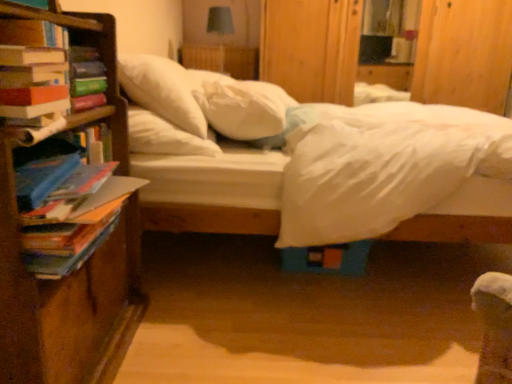
Where is `blue fabric lampshade at upper center`? The height and width of the screenshot is (384, 512). blue fabric lampshade at upper center is located at coordinates (220, 26).

The width and height of the screenshot is (512, 384). What do you see at coordinates (162, 91) in the screenshot?
I see `white soft pillow at center, arranged as the 1th pillow when viewed from the left` at bounding box center [162, 91].

You are a GUI agent. You are given a task and a screenshot of the screen. Output one action in this format:
    pyautogui.click(x=<x>, y=<y>)
    Task: Click on the white soft bed at center
    
    Given the screenshot: What is the action you would take?
    pyautogui.click(x=194, y=158)

Image resolution: width=512 pixels, height=384 pixels. I want to click on hardcover book at left, which is the first book from top to bottom, so click(x=32, y=35).

Describe the element at coordinates (68, 241) in the screenshot. I see `multicolored paper book at left, the second book viewed from the top` at that location.

What do you see at coordinates (240, 105) in the screenshot? I see `white soft pillow at center, which ranks as the 1th pillow in right-to-left order` at bounding box center [240, 105].

Identify the location of blue fabric lampshade at upper center. (220, 26).

Based on the photo, from the image's perspective, is white soft bed at center located above or below wooden bookcase at left?

white soft bed at center is above wooden bookcase at left.

Can you confirm if white soft bed at center is positioned to the right of wooden bookcase at left?

Yes, white soft bed at center is to the right of wooden bookcase at left.

Is white soft bed at center not close to wooden bookcase at left?

That's not correct — white soft bed at center is a little close to wooden bookcase at left.

Would you say white soft bed at center is inside or outside wooden bookcase at left?

white soft bed at center is outside wooden bookcase at left.

From the picture: Considering the sizes of objects white soft pillow at center, the 2th pillow when ordered from right to left, and blue fabric lampshade at upper center in the image provided, who is taller, white soft pillow at center, the 2th pillow when ordered from right to left, or blue fabric lampshade at upper center?

Standing taller between the two is blue fabric lampshade at upper center.

Is white soft pillow at center, the 2th pillow when ordered from right to left, oriented away from blue fabric lampshade at upper center?

No, white soft pillow at center, the 2th pillow when ordered from right to left, is not facing away from blue fabric lampshade at upper center.

Is white soft pillow at center, the 2th pillow when ordered from right to left, thinner than blue fabric lampshade at upper center?

Incorrect, the width of white soft pillow at center, the 2th pillow when ordered from right to left, is not less than that of blue fabric lampshade at upper center.

Identify the location of pillow that is the 1st object to the right of the hardcover book at left, positioned as the second book in bottom-to-top order, starting at the anchor. (162, 91).

Considering the positions of objects hardcover book at left, positioned as the second book in bottom-to-top order, and white soft pillow at center, the 2th pillow when ordered from right to left, in the image provided, who is behind, hardcover book at left, positioned as the second book in bottom-to-top order, or white soft pillow at center, the 2th pillow when ordered from right to left,?

white soft pillow at center, the 2th pillow when ordered from right to left, is further away from the camera.

Which is behind, point (59, 80) or point (132, 70)?

The point (132, 70) is farther from the camera.

Based on the photo, from a real-world perspective, who is located lower, wooden bookcase at left or white soft bed at center?

white soft bed at center, from a real-world perspective.

Based on the photo, is wooden bookcase at left placed right next to white soft bed at center?

wooden bookcase at left and white soft bed at center are clearly separated.

Considering the sizes of wooden bookcase at left and white soft bed at center in the image, is wooden bookcase at left wider or thinner than white soft bed at center?

Clearly, wooden bookcase at left has less width compared to white soft bed at center.

Is multicolored paper book at left, placed as the first book when sorted from bottom to top, located outside hardcover book at left, which is the first book from top to bottom?

Yes, multicolored paper book at left, placed as the first book when sorted from bottom to top, is located beyond the bounds of hardcover book at left, which is the first book from top to bottom.

Considering the relative sizes of multicolored paper book at left, the second book viewed from the top, and hardcover book at left, positioned as the second book in bottom-to-top order, in the image provided, is multicolored paper book at left, the second book viewed from the top, bigger than hardcover book at left, positioned as the second book in bottom-to-top order,?

Yes, multicolored paper book at left, the second book viewed from the top, is bigger than hardcover book at left, positioned as the second book in bottom-to-top order.

From the image's perspective, is multicolored paper book at left, the second book viewed from the top, located above hardcover book at left, which is the first book from top to bottom?

No, from the image's perspective, multicolored paper book at left, the second book viewed from the top, is not above hardcover book at left, which is the first book from top to bottom.

Between multicolored paper book at left, the second book viewed from the top, and hardcover book at left, positioned as the second book in bottom-to-top order, which one has larger width?

multicolored paper book at left, the second book viewed from the top.

Is multicolored paper book at left, placed as the first book when sorted from bottom to top, oriented away from white soft pillow at center, arranged as the 1th pillow when viewed from the left?

That's not correct — multicolored paper book at left, placed as the first book when sorted from bottom to top, is not looking away from white soft pillow at center, arranged as the 1th pillow when viewed from the left.

Is multicolored paper book at left, the second book viewed from the top, positioned far away from white soft pillow at center, arranged as the 1th pillow when viewed from the left?

multicolored paper book at left, the second book viewed from the top, is near white soft pillow at center, arranged as the 1th pillow when viewed from the left, not far away.

Considering their positions, is multicolored paper book at left, placed as the first book when sorted from bottom to top, located in front of or behind white soft pillow at center, arranged as the 1th pillow when viewed from the left?

Clearly, multicolored paper book at left, placed as the first book when sorted from bottom to top, is in front of white soft pillow at center, arranged as the 1th pillow when viewed from the left.

Starting from the white soft pillow at center, arranged as the 1th pillow when viewed from the left, which book is the 2nd one in front? Please provide its 2D coordinates.

[(68, 241)]

Considering the positions of point (170, 119) and point (59, 329), is point (170, 119) closer or farther from the camera than point (59, 329)?

Point (170, 119).

Considering the relative positions of white soft pillow at center, arranged as the 1th pillow when viewed from the left, and wooden bookcase at left in the image provided, is white soft pillow at center, arranged as the 1th pillow when viewed from the left, to the right of wooden bookcase at left from the viewer's perspective?

Yes, white soft pillow at center, arranged as the 1th pillow when viewed from the left, is to the right of wooden bookcase at left.

From the picture: Could you tell me if white soft pillow at center, arranged as the 1th pillow when viewed from the left, is turned towards wooden bookcase at left?

No.

Locate an element on the screen. This screenshot has height=384, width=512. bookcase located below the white soft pillow at center, arranged as the 1th pillow when viewed from the left (from the image's perspective) is located at coordinates (66, 299).

The width and height of the screenshot is (512, 384). Find the location of `bed located on the right of wooden bookcase at left`. bed located on the right of wooden bookcase at left is located at coordinates (194, 158).

Image resolution: width=512 pixels, height=384 pixels. I want to click on table lamp that is above the white soft pillow at center, arranged as the 1th pillow when viewed from the left (from the image's perspective), so click(220, 26).

Based on their spatial positions, is blue fabric lampshade at upper center or wooden bookcase at left further from white soft bed at center?

blue fabric lampshade at upper center lies further to white soft bed at center than the other object.

Considering their positions, is wooden bookcase at left positioned closer to white soft bed at center than blue fabric lampshade at upper center?

wooden bookcase at left lies closer to white soft bed at center than the other object.

Based on their spatial positions, is multicolored paper book at left, placed as the first book when sorted from bottom to top, or white soft bed at center further from blue fabric lampshade at upper center?

multicolored paper book at left, placed as the first book when sorted from bottom to top, is further to blue fabric lampshade at upper center.

Looking at the image, which one is located further to blue fabric lampshade at upper center, white soft pillow at center, the 2th pillow when ordered from right to left, or white soft pillow at center, which ranks as the 1th pillow in right-to-left order?

Among the two, white soft pillow at center, the 2th pillow when ordered from right to left, is located further to blue fabric lampshade at upper center.

Which object lies nearer to the anchor point white soft pillow at center, which ranks as the 1th pillow in right-to-left order, blue fabric lampshade at upper center or wooden bookcase at left?

Among the two, wooden bookcase at left is located nearer to white soft pillow at center, which ranks as the 1th pillow in right-to-left order.

Estimate the real-world distances between objects in this image. Which object is further from hardcover book at left, which is the first book from top to bottom, white soft pillow at center, which ranks as the 1th pillow in right-to-left order, or white soft bed at center?

The object further to hardcover book at left, which is the first book from top to bottom, is white soft pillow at center, which ranks as the 1th pillow in right-to-left order.

When comparing their distances from wooden bookcase at left, does blue fabric lampshade at upper center or white soft pillow at center, which ranks as the 1th pillow in right-to-left order, seem further?

The object further to wooden bookcase at left is blue fabric lampshade at upper center.

Considering their positions, is white soft pillow at center, positioned as the 2th pillow in left-to-right order, positioned closer to white soft bed at center than white soft pillow at center, arranged as the 1th pillow when viewed from the left?

white soft pillow at center, arranged as the 1th pillow when viewed from the left.

Where is `pillow between white soft pillow at center, arranged as the 1th pillow when viewed from the left, and blue fabric lampshade at upper center in the front-back direction`? pillow between white soft pillow at center, arranged as the 1th pillow when viewed from the left, and blue fabric lampshade at upper center in the front-back direction is located at coordinates (240, 105).

Where is `bed between wooden bookcase at left and white soft pillow at center, which ranks as the 1th pillow in right-to-left order, along the z-axis`? This screenshot has height=384, width=512. bed between wooden bookcase at left and white soft pillow at center, which ranks as the 1th pillow in right-to-left order, along the z-axis is located at coordinates (194, 158).

At what (x,y) coordinates should I click in order to perform the action: click on bookcase between hardcover book at left, positioned as the second book in bottom-to-top order, and multicolored paper book at left, placed as the first book when sorted from bottom to top, from top to bottom. Please return your answer as a coordinate pair (x, y). Looking at the image, I should click on (66, 299).

Locate an element on the screen. Image resolution: width=512 pixels, height=384 pixels. book between multicolored paper book at left, the second book viewed from the top, and white soft pillow at center, arranged as the 1th pillow when viewed from the left, along the z-axis is located at coordinates 32,35.